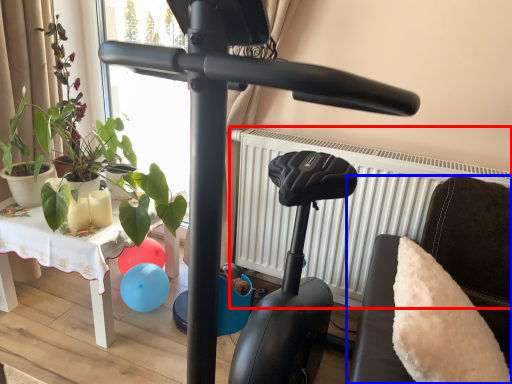
Question: Which of the following is the farthest to the observer, radiator (highlighted by a red box) or furniture (highlighted by a blue box)?

Choices:
 (A) radiator
 (B) furniture

Answer: (A)